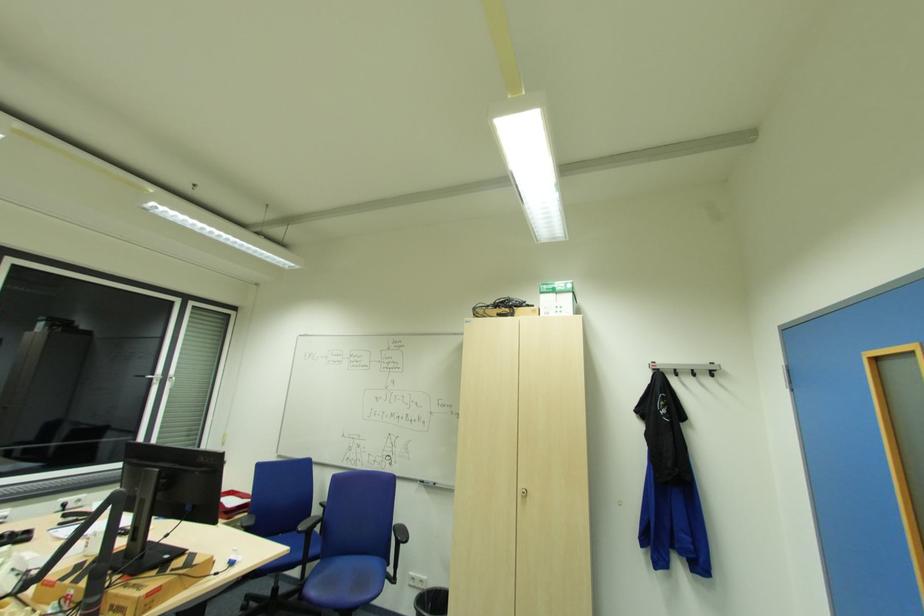
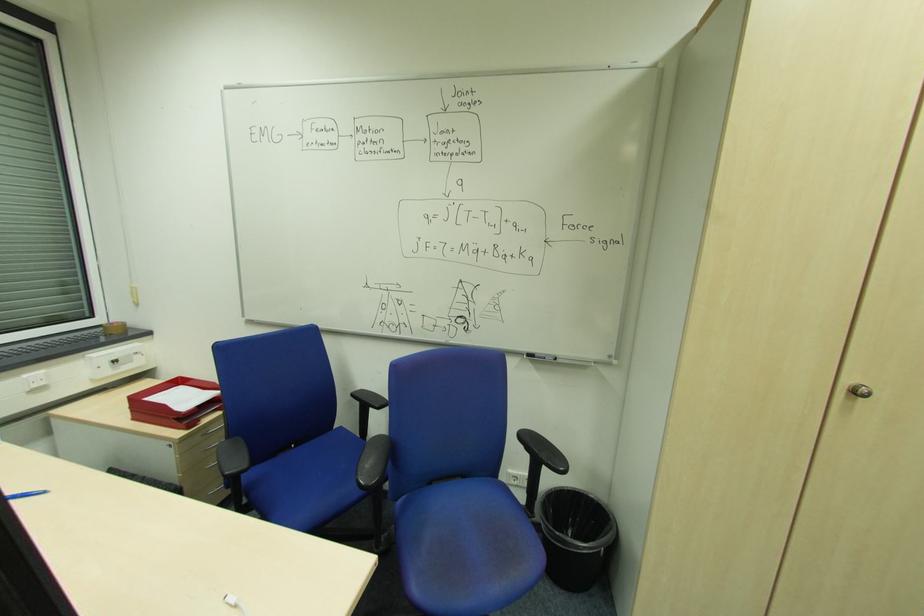
Find the pixel in the second image that matches pixel 527 493 in the first image.

(860, 392)